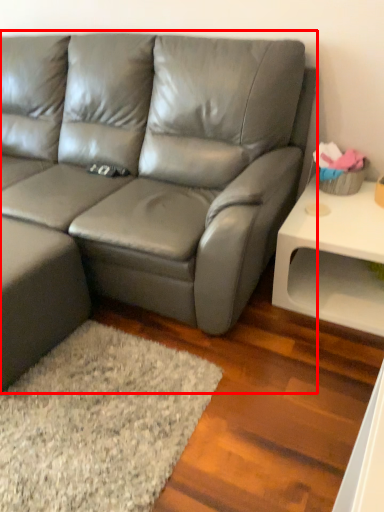
Question: Where is studio couch (annotated by the red box) located in relation to table in the image?

Choices:
 (A) right
 (B) left

Answer: (B)